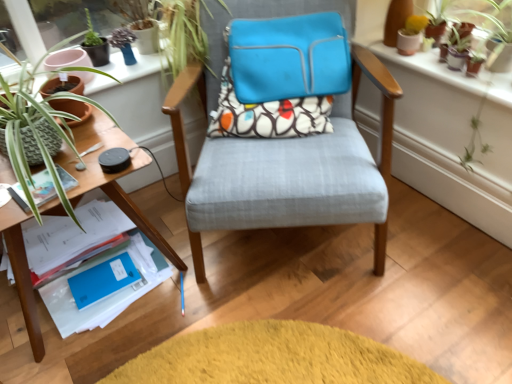
Question: From the image's perspective, does blue matte paper at lower left, arranged as the first paperback book when ordered from the bottom, appear lower than terracotta clay pots at upper right?

Choices:
 (A) yes
 (B) no

Answer: (A)

Question: Considering the relative sizes of blue matte paper at lower left, arranged as the first paperback book when ordered from the bottom, and terracotta clay pots at upper right in the image provided, is blue matte paper at lower left, arranged as the first paperback book when ordered from the bottom, shorter than terracotta clay pots at upper right?

Choices:
 (A) no
 (B) yes

Answer: (B)

Question: Is blue matte paper at lower left, arranged as the first paperback book when ordered from the bottom, thinner than terracotta clay pots at upper right?

Choices:
 (A) no
 (B) yes

Answer: (B)

Question: Can you confirm if blue matte paper at lower left, arranged as the first paperback book when ordered from the bottom, is bigger than terracotta clay pots at upper right?

Choices:
 (A) no
 (B) yes

Answer: (A)

Question: Are blue matte paper at lower left, marked as the second paperback book in a top-to-bottom arrangement, and terracotta clay pots at upper right beside each other?

Choices:
 (A) yes
 (B) no

Answer: (B)

Question: In terms of width, does wooden table at left look wider or thinner when compared to terracotta clay pots at upper right?

Choices:
 (A) wide
 (B) thin

Answer: (A)

Question: Based on their positions, is wooden table at left located to the left or right of terracotta clay pots at upper right?

Choices:
 (A) left
 (B) right

Answer: (A)

Question: Considering the positions of wooden table at left and terracotta clay pots at upper right in the image, is wooden table at left bigger or smaller than terracotta clay pots at upper right?

Choices:
 (A) big
 (B) small

Answer: (A)

Question: From a real-world perspective, is wooden table at left positioned above or below terracotta clay pots at upper right?

Choices:
 (A) below
 (B) above

Answer: (A)

Question: Is terracotta clay pots at upper right in front of or behind patterned fabric pillow at center in the image?

Choices:
 (A) behind
 (B) front

Answer: (B)

Question: Is terracotta clay pots at upper right taller or shorter than patterned fabric pillow at center?

Choices:
 (A) short
 (B) tall

Answer: (A)

Question: Considering the relative positions of terracotta clay pots at upper right and patterned fabric pillow at center in the image provided, is terracotta clay pots at upper right to the left or to the right of patterned fabric pillow at center?

Choices:
 (A) left
 (B) right

Answer: (B)

Question: Does point (415, 62) appear closer or farther from the camera than point (223, 99)?

Choices:
 (A) closer
 (B) farther

Answer: (A)

Question: From a real-world perspective, is textured fabric chair at center, marked as the 1th chair in a front-to-back arrangement, above or below matte paper at left, placed as the second paperback book when sorted from bottom to top?

Choices:
 (A) above
 (B) below

Answer: (B)

Question: From the image's perspective, is textured fabric chair at center, marked as the 1th chair in a front-to-back arrangement, above or below matte paper at left, placed as the second paperback book when sorted from bottom to top?

Choices:
 (A) below
 (B) above

Answer: (B)